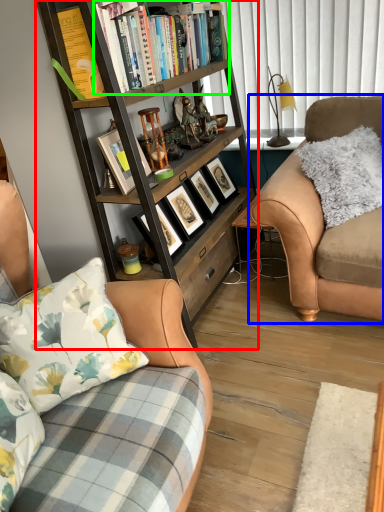
Question: Which object is the closest to the bookcase (highlighted by a red box)? Choose among these: studio couch (highlighted by a blue box) or book (highlighted by a green box).

Choices:
 (A) studio couch
 (B) book

Answer: (B)